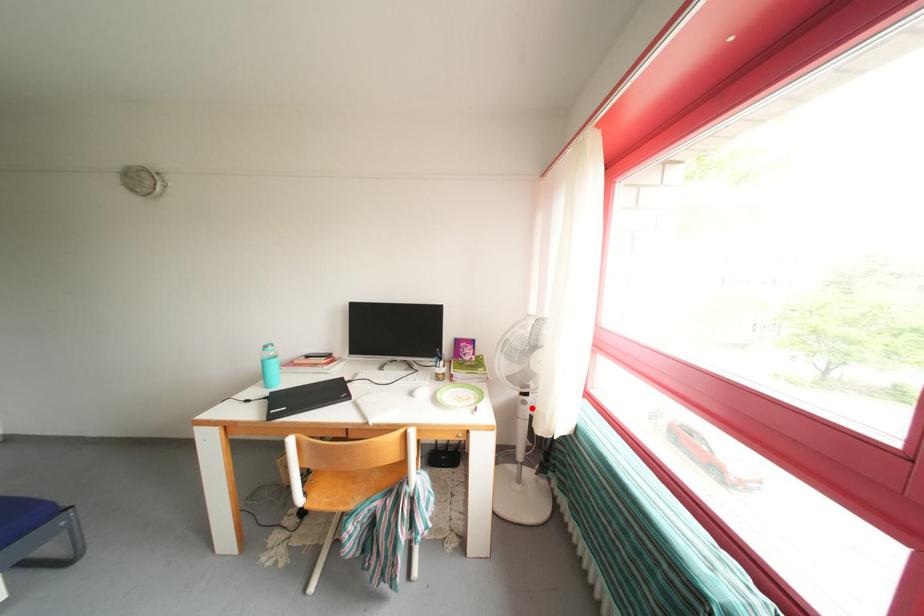
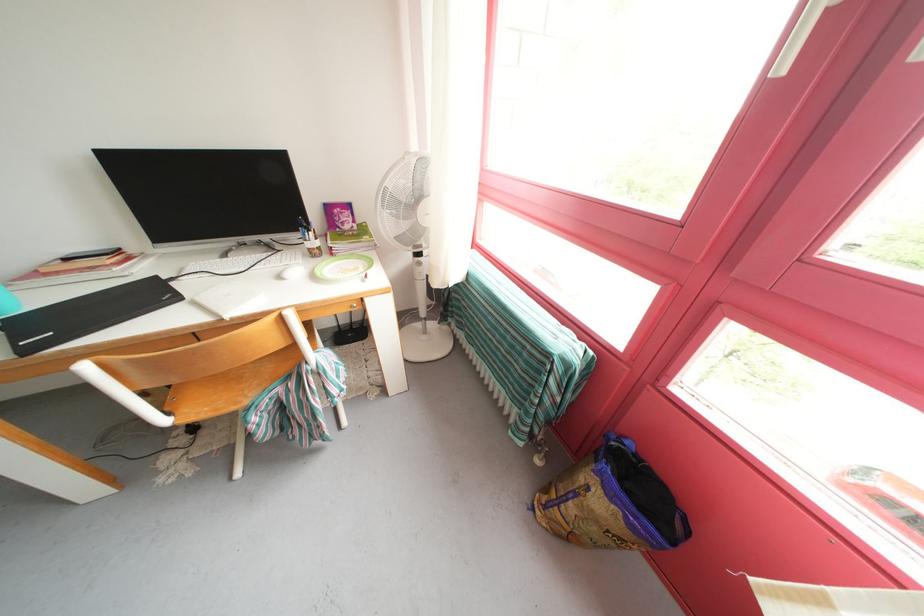
Find the pixel in the second image that matches the highlighted location in the first image.

(427, 270)